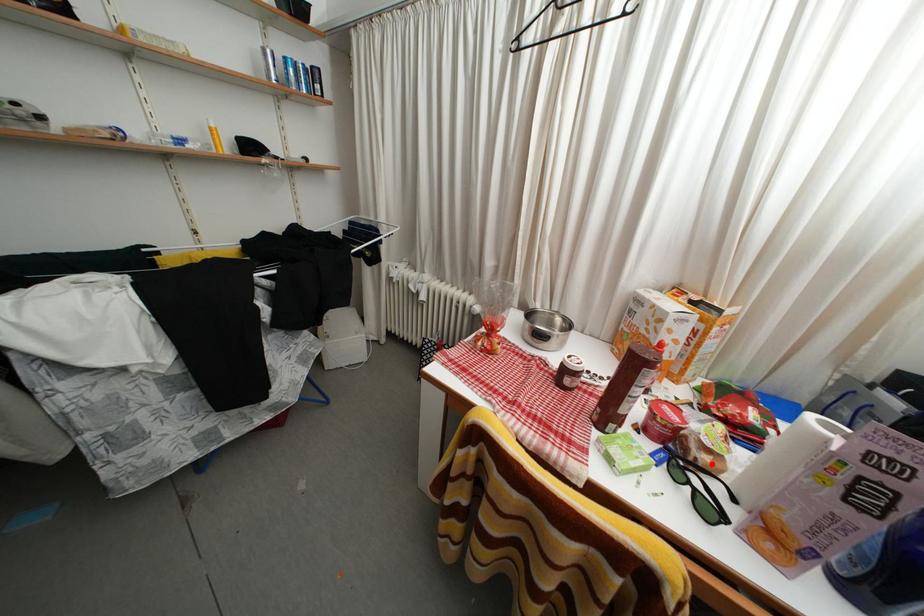
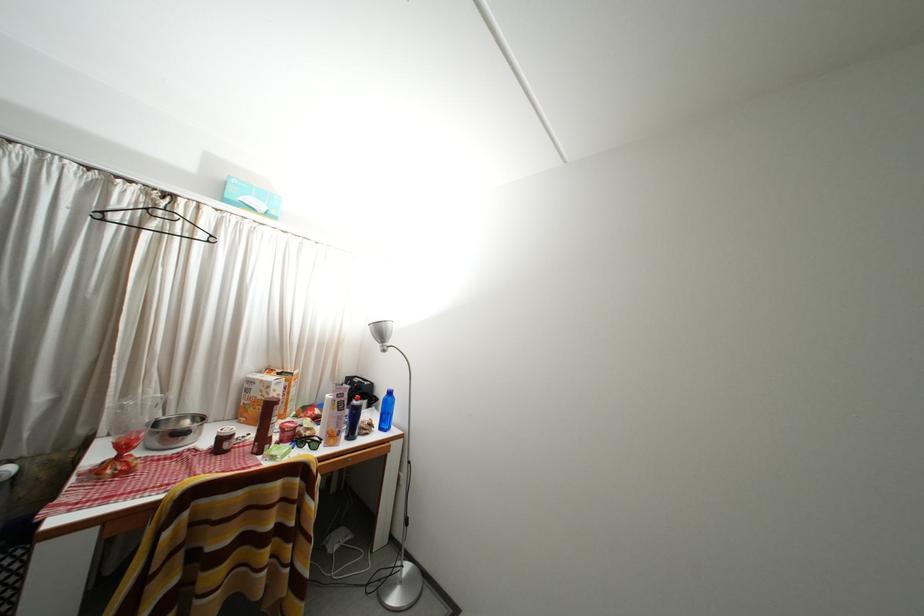
In the second image, find the point that corresponds to the highlighted location in the first image.

(315, 439)